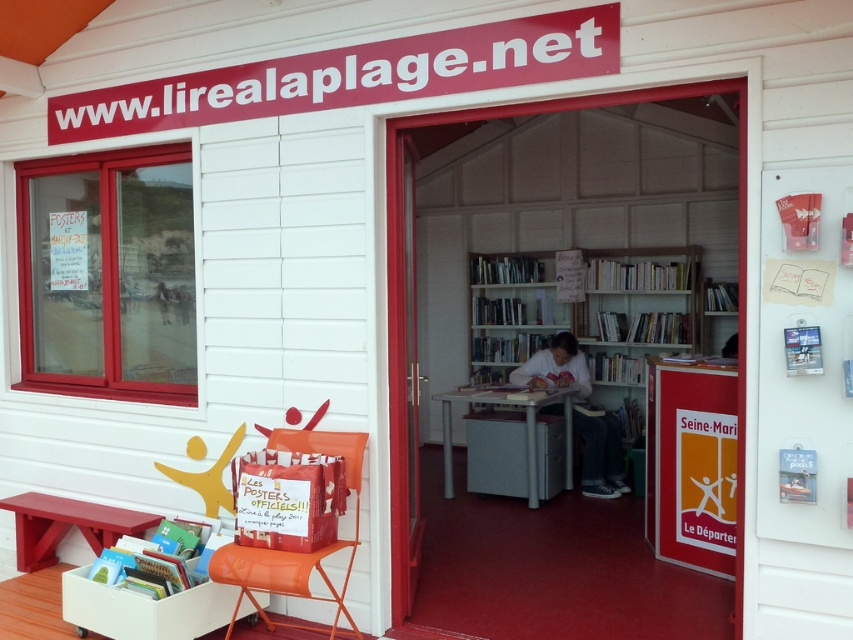
You are standing in front of the library entrance and want to enter. You notice the red cardboard sign at right and the wooden door at center. Which object is closer to you?

The red cardboard sign at right is closer to you because it is further to the viewer than the wooden door at center.

Looking at this image, you are a visitor standing at the entrance of the library and want to place a tall potted plant on one of the available surfaces. Which object between the white wooden bookshelf at center and the matte red bench at lower left would be more suitable for placing the tall potted plant?

The white wooden bookshelf at center has a greater height compared to the matte red bench at lower left, so it would be more suitable for placing the tall potted plant as it can accommodate taller items.

You are a delivery person with a cart that is 10 feet long. You need to move your cart through the space between the white wooden bookshelf at center and the wooden door at center. Can your cart fit through that space?

The distance between the white wooden bookshelf at center and the wooden door at center is 11.66 feet, which is longer than the cart length of 10 feet. Therefore, the cart can fit through the space between the white wooden bookshelf at center and the wooden door at center.